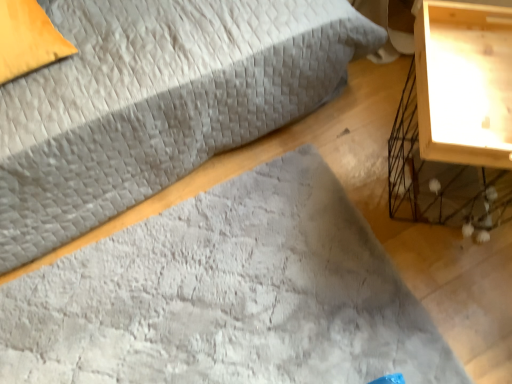
Question: From the image's perspective, is velvet gray bed at center over wooden nightstand at right?

Choices:
 (A) no
 (B) yes

Answer: (B)

Question: Can you confirm if velvet gray bed at center is positioned to the right of wooden nightstand at right?

Choices:
 (A) no
 (B) yes

Answer: (A)

Question: Is velvet gray bed at center not near wooden nightstand at right?

Choices:
 (A) no
 (B) yes

Answer: (A)

Question: From the image's perspective, does velvet gray bed at center appear lower than wooden nightstand at right?

Choices:
 (A) no
 (B) yes

Answer: (A)

Question: Are velvet gray bed at center and wooden nightstand at right beside each other?

Choices:
 (A) yes
 (B) no

Answer: (B)

Question: Can you confirm if velvet gray bed at center is taller than wooden nightstand at right?

Choices:
 (A) no
 (B) yes

Answer: (B)

Question: Does orange fabric pillow at upper left come behind velvet gray bed at center?

Choices:
 (A) no
 (B) yes

Answer: (B)

Question: From a real-world perspective, is orange fabric pillow at upper left located beneath velvet gray bed at center?

Choices:
 (A) no
 (B) yes

Answer: (A)

Question: Can you confirm if orange fabric pillow at upper left is shorter than velvet gray bed at center?

Choices:
 (A) no
 (B) yes

Answer: (B)

Question: Is orange fabric pillow at upper left completely or partially outside of velvet gray bed at center?

Choices:
 (A) no
 (B) yes

Answer: (A)

Question: From the image's perspective, is orange fabric pillow at upper left below velvet gray bed at center?

Choices:
 (A) no
 (B) yes

Answer: (B)

Question: Does orange fabric pillow at upper left lie in front of velvet gray bed at center?

Choices:
 (A) no
 (B) yes

Answer: (A)

Question: Does wooden nightstand at right have a larger size compared to velvet gray bed at center?

Choices:
 (A) no
 (B) yes

Answer: (A)